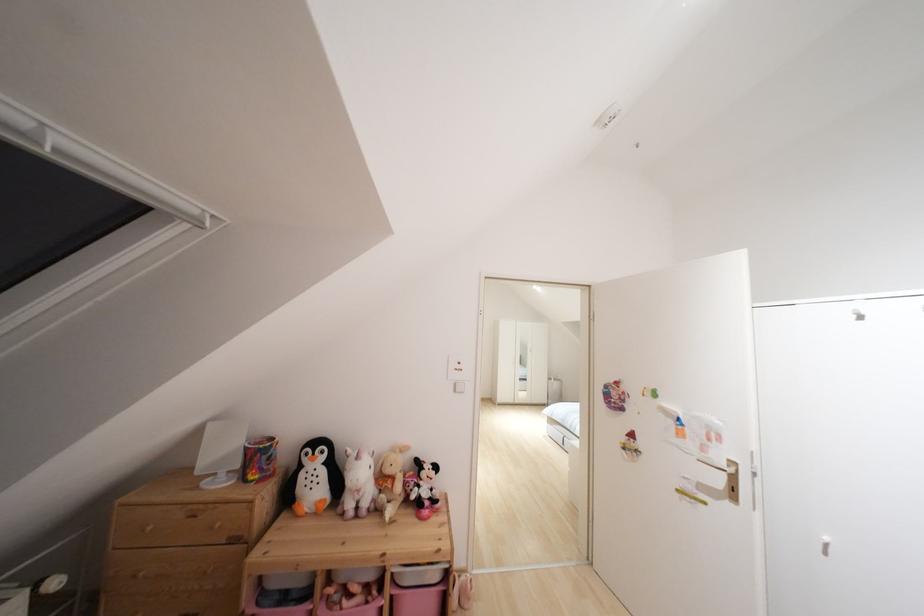
Image resolution: width=924 pixels, height=616 pixels. Identify the location of bunny stuffed toy. (313, 477).